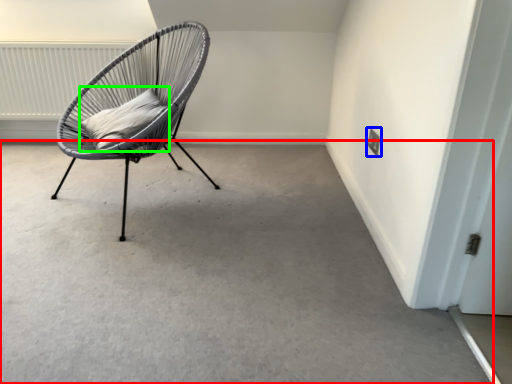
Question: Which is nearer to the concrete (highlighted by a red box)? electric outlet (highlighted by a blue box) or pillow (highlighted by a green box).

Choices:
 (A) electric outlet
 (B) pillow

Answer: (B)